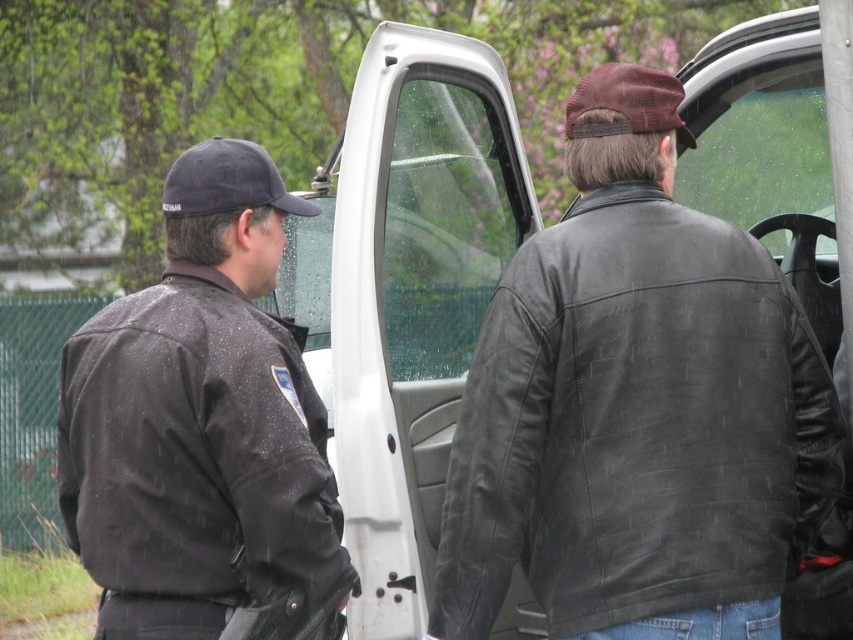
I want to click on black leather jacket at right, so click(635, 424).

Is black leather jacket at right positioned behind black fabric baseball cap at left?

No, it is in front of black fabric baseball cap at left.

At what (x,y) coordinates should I click in order to perform the action: click on black leather jacket at right. Please return your answer as a coordinate pair (x, y). This screenshot has width=853, height=640. Looking at the image, I should click on (635, 424).

At what (x,y) coordinates should I click in order to perform the action: click on black leather jacket at right. Please return your answer as a coordinate pair (x, y). Looking at the image, I should click on (635, 424).

What do you see at coordinates (635, 424) in the screenshot? I see `black leather jacket at right` at bounding box center [635, 424].

Who is more distant from viewer, [593,529] or [202,588]?

The point [593,529] is more distant.

The width and height of the screenshot is (853, 640). I want to click on black leather jacket at right, so click(x=635, y=424).

Does black leather jacket at left come in front of black fabric baseball cap at left?

Yes, black leather jacket at left is in front of black fabric baseball cap at left.

What do you see at coordinates (193, 458) in the screenshot? I see `black leather jacket at left` at bounding box center [193, 458].

Where is `black leather jacket at left`? black leather jacket at left is located at coordinates (193, 458).